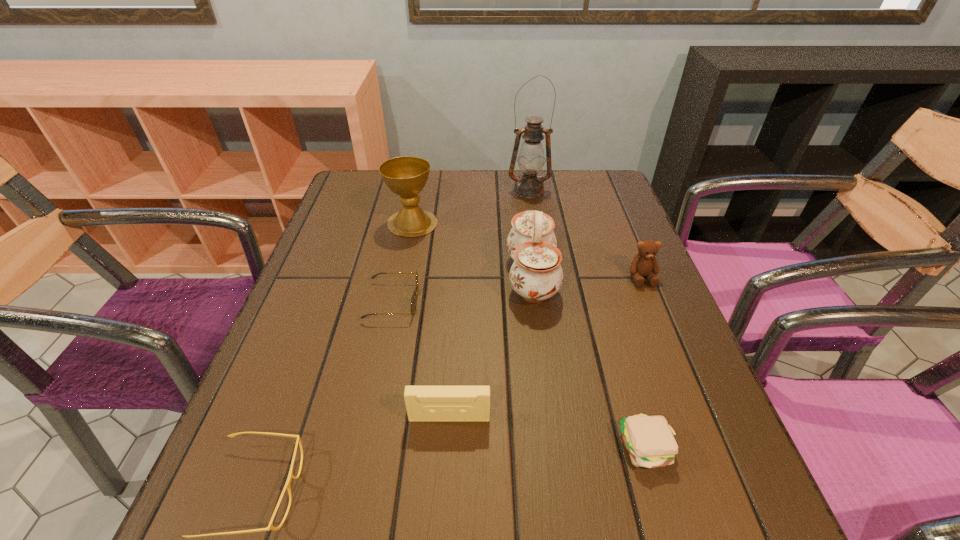
I want to click on chalice at the left edge, so click(x=406, y=176).

Locate an element on the screen. This screenshot has width=960, height=540. sunglasses at the left edge is located at coordinates (413, 305).

Locate an element on the screen. teddy bear at the right edge is located at coordinates (644, 264).

At what (x,y) coordinates should I click in order to perform the action: click on patty that is at the right edge. Please return your answer as a coordinate pair (x, y). Looking at the image, I should click on pyautogui.click(x=650, y=441).

Locate an element on the screen. Image resolution: width=960 pixels, height=540 pixels. object at the far left corner is located at coordinates (406, 176).

This screenshot has width=960, height=540. I want to click on vacant space at the far edge of the desktop, so click(x=492, y=204).

This screenshot has width=960, height=540. In the image, there is a desktop. Identify the location of vacant area at the left edge. (295, 330).

Locate an element on the screen. The height and width of the screenshot is (540, 960). vacant space at the right edge of the desktop is located at coordinates (595, 215).

In the image, there is a desktop. Where is `vacant area at the far left corner`? This screenshot has width=960, height=540. vacant area at the far left corner is located at coordinates (389, 191).

At what (x,y) coordinates should I click in order to perform the action: click on vacant space at the near left corner of the desktop. Please return your answer as a coordinate pair (x, y). Looking at the image, I should click on (271, 511).